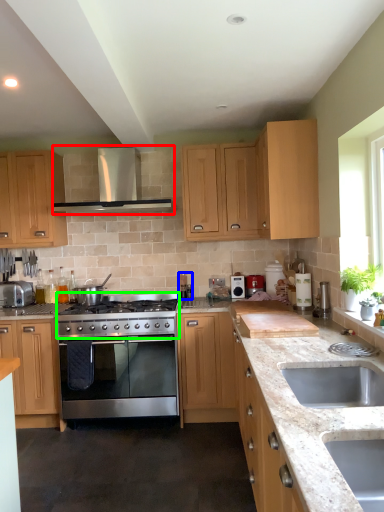
Question: Considering the real-world distances, which object is closest to exhaust hood (highlighted by a red box)? coffee machine (highlighted by a blue box) or gas stove (highlighted by a green box).

Choices:
 (A) coffee machine
 (B) gas stove

Answer: (B)